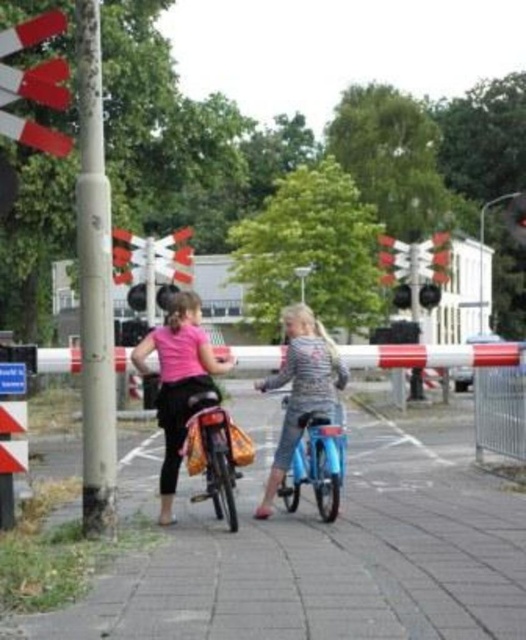
Question: Which of these objects is positioned closest to the metallic red traffic light at upper right?

Choices:
 (A) pink matte shirt at center
 (B) blue metallic bicycle at center
 (C) matte black bicycle at center
 (D) white plastic traffic light at upper left

Answer: (B)

Question: Does blue metallic bicycle at center appear over metallic red traffic light at upper right?

Choices:
 (A) no
 (B) yes

Answer: (A)

Question: Does matte black bicycle at center lie behind metallic red traffic light at upper right?

Choices:
 (A) no
 (B) yes

Answer: (A)

Question: Which of the following is the closest to the observer?

Choices:
 (A) blue metallic bicycle at center
 (B) metallic red traffic light at upper right
 (C) pink matte shirt at center
 (D) white plastic traffic light at upper left

Answer: (D)

Question: Which point is farther to the camera?

Choices:
 (A) (52, 86)
 (B) (186, 445)
 (C) (339, 422)
 (D) (184, 296)

Answer: (C)

Question: Is blue metallic bicycle at center to the right of metallic red traffic light at upper right from the viewer's perspective?

Choices:
 (A) no
 (B) yes

Answer: (A)